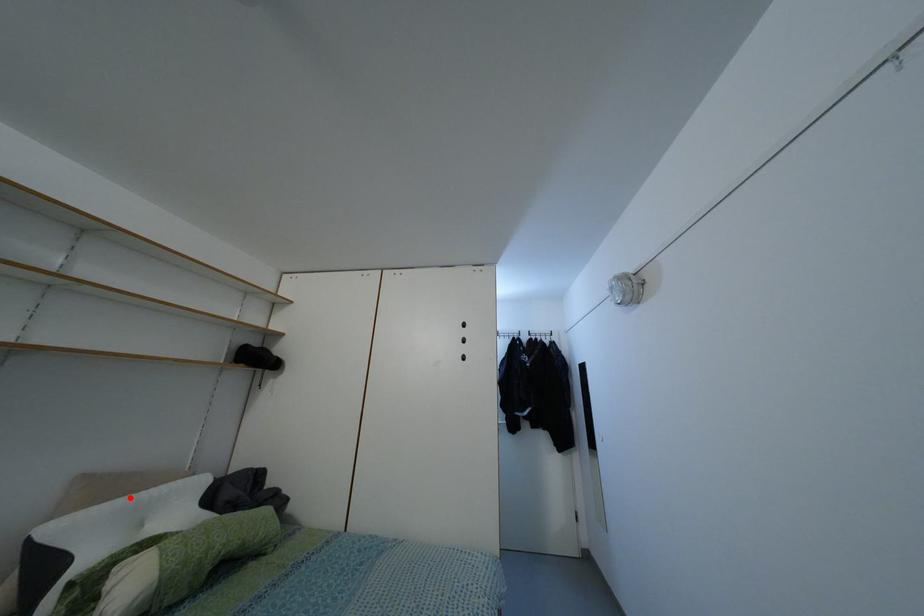
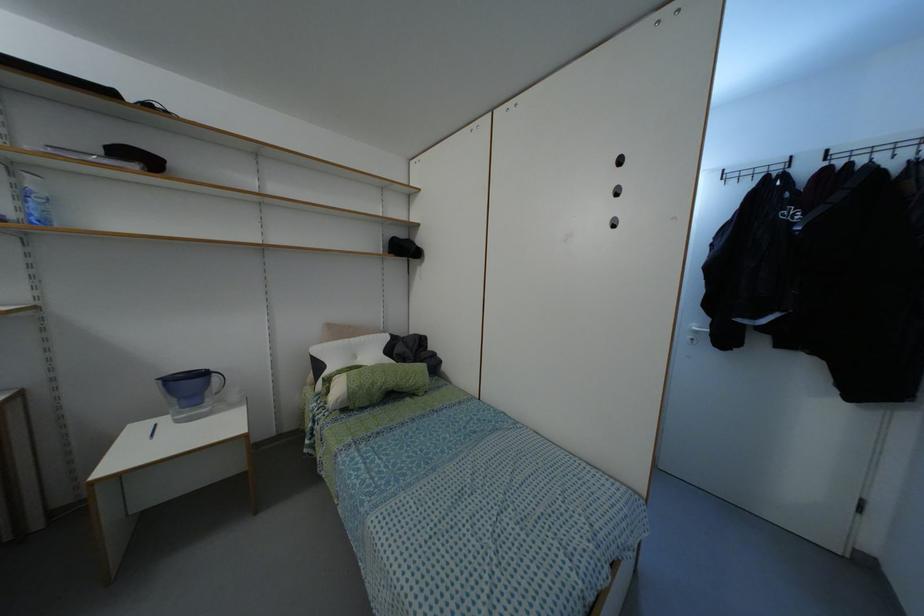
Find the pixel in the second image that matches the highlighted location in the first image.

(345, 339)